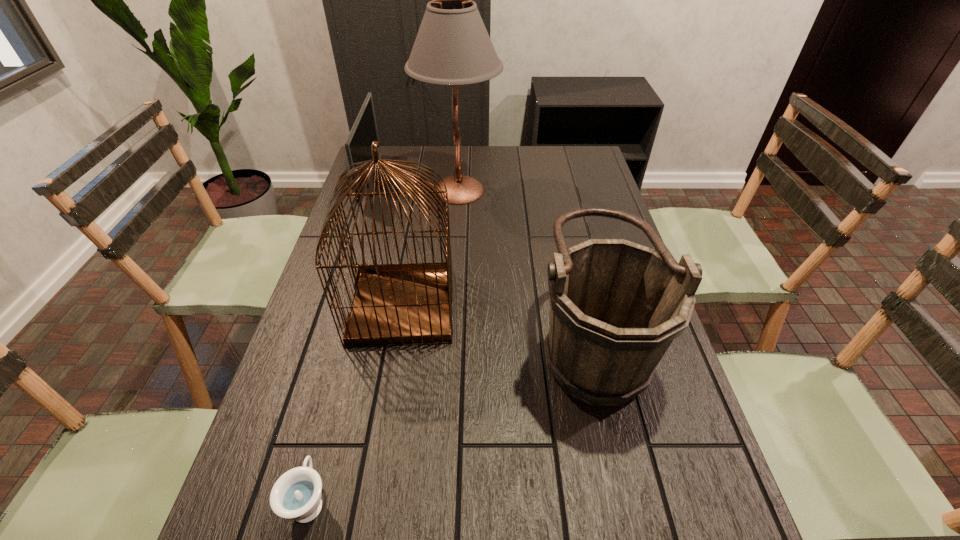
This screenshot has height=540, width=960. What are the coordinates of `monitor present at the left edge` in the screenshot? It's located at (364, 131).

Locate an element on the screen. This screenshot has width=960, height=540. teacup that is at the left edge is located at coordinates (296, 495).

Locate an element on the screen. object situated at the right edge is located at coordinates pos(616,306).

This screenshot has width=960, height=540. In order to click on object that is at the far left corner in this screenshot , I will do `click(364, 131)`.

In order to click on vacant space at the far edge of the desktop in this screenshot , I will do `click(466, 175)`.

Where is `vacant space at the left edge`? The image size is (960, 540). vacant space at the left edge is located at coordinates (394, 192).

In the image, there is a desktop. Identify the location of vacant space at the right edge. Image resolution: width=960 pixels, height=540 pixels. (574, 199).

The height and width of the screenshot is (540, 960). I want to click on vacant region at the far left corner, so click(395, 159).

Find the location of `free space between the nearest object and the fourth tallest object`. free space between the nearest object and the fourth tallest object is located at coordinates (338, 341).

The height and width of the screenshot is (540, 960). I want to click on vacant space that's between the rightmost object and the table lamp, so click(525, 266).